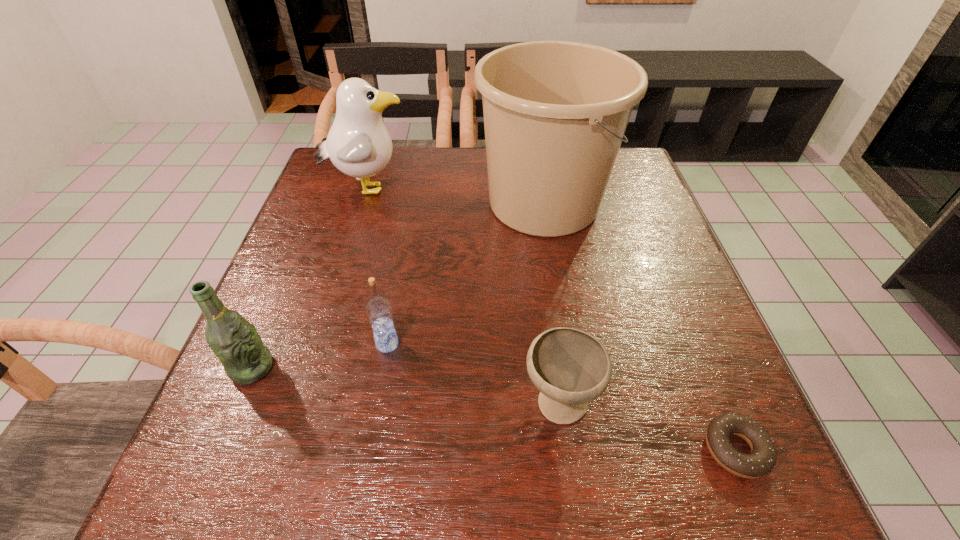
Find the location of `free location that satisfies the following two spatial constraints: 1. on the back side of the vodka; 2. on the beak of the gull`. free location that satisfies the following two spatial constraints: 1. on the back side of the vodka; 2. on the beak of the gull is located at coordinates (415, 188).

Identify the location of blank space that satisfies the following two spatial constraints: 1. on the beak of the gull; 2. on the back side of the bucket. (364, 202).

Where is `vacant space that satisfies the following two spatial constraints: 1. on the beak of the fifth shortest object; 2. on the left side of the second shortest object`? vacant space that satisfies the following two spatial constraints: 1. on the beak of the fifth shortest object; 2. on the left side of the second shortest object is located at coordinates (302, 403).

Find the location of a particular element. The width and height of the screenshot is (960, 540). blank area in the image that satisfies the following two spatial constraints: 1. on the beak of the gull; 2. on the right side of the shortest object is located at coordinates (289, 449).

Where is `vacant point that satisfies the following two spatial constraints: 1. on the surface of the third tallest object; 2. on the back side of the rightmost object`? This screenshot has width=960, height=540. vacant point that satisfies the following two spatial constraints: 1. on the surface of the third tallest object; 2. on the back side of the rightmost object is located at coordinates (218, 449).

Image resolution: width=960 pixels, height=540 pixels. In order to click on free space in the image that satisfies the following two spatial constraints: 1. on the beak of the chalice; 2. on the right side of the gull in this screenshot , I will do `click(302, 403)`.

Where is `vacant space that satisfies the following two spatial constraints: 1. on the surface of the doughnut; 2. on the right side of the beer bottle`? vacant space that satisfies the following two spatial constraints: 1. on the surface of the doughnut; 2. on the right side of the beer bottle is located at coordinates (218, 449).